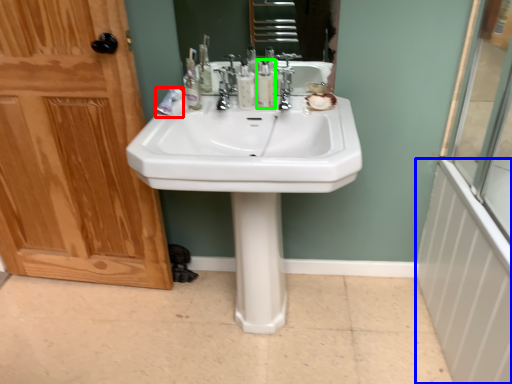
Question: Based on their relative distances, which object is nearer to toothpaste (highlighted by a red box)? Choose from radiator (highlighted by a blue box) and mouthwash (highlighted by a green box).

Choices:
 (A) radiator
 (B) mouthwash

Answer: (B)